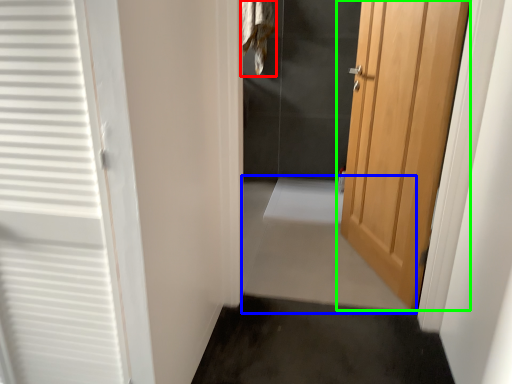
Question: Based on their relative distances, which object is farther from laundry (highlighted by a red box)? Choose from path (highlighted by a blue box) and door (highlighted by a green box).

Choices:
 (A) path
 (B) door

Answer: (B)